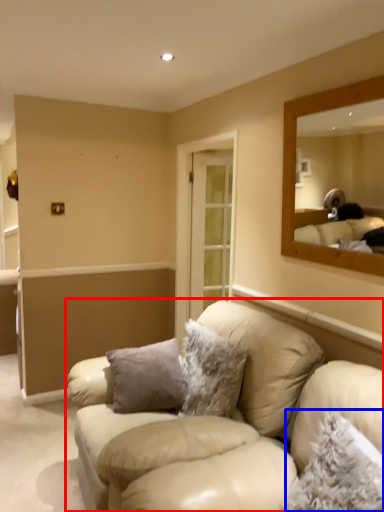
Question: Which object appears farthest to the camera in this image, studio couch (highlighted by a red box) or pillow (highlighted by a blue box)?

Choices:
 (A) studio couch
 (B) pillow

Answer: (A)